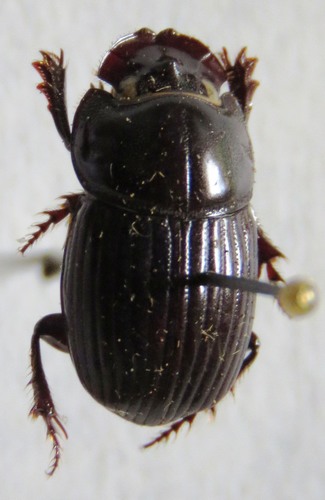
Identify the location of bulb. (290, 295).